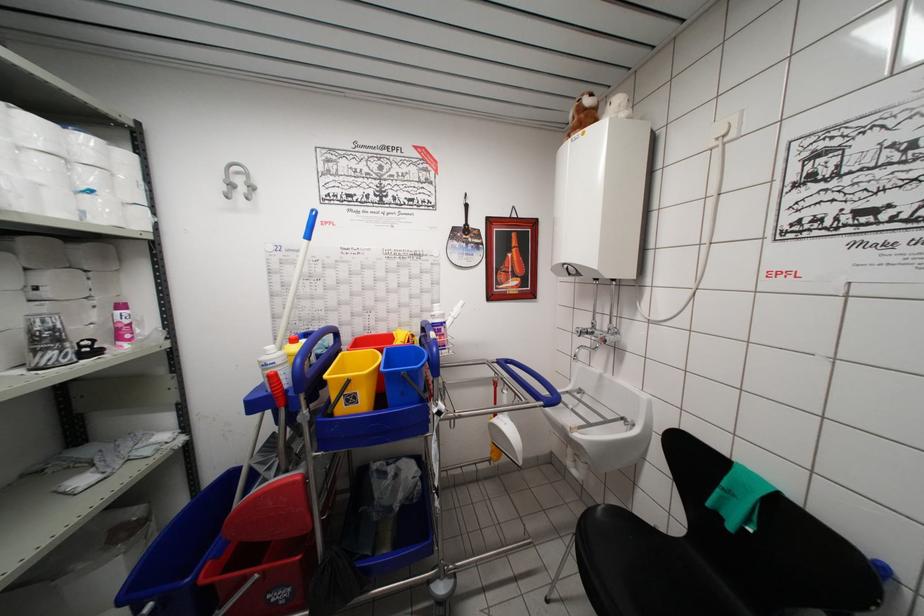
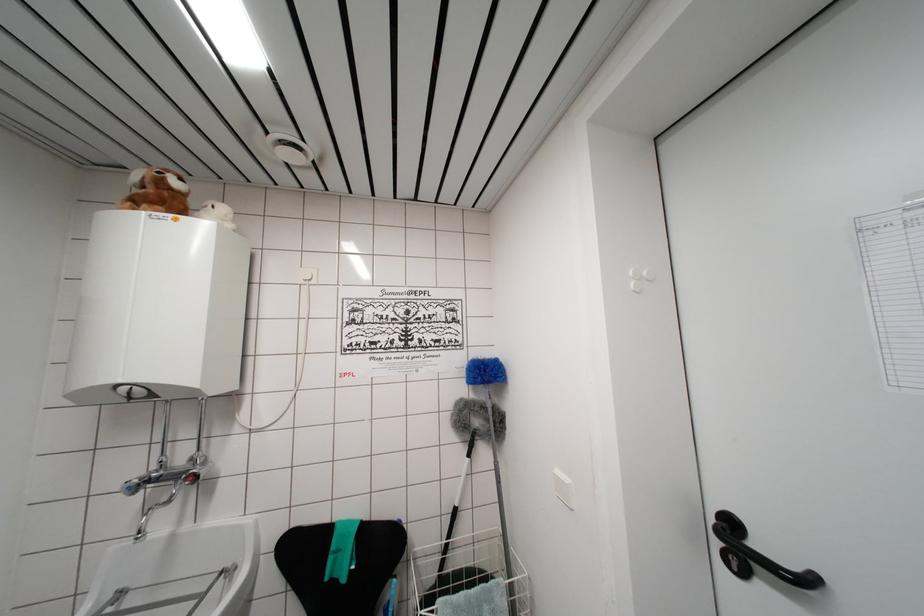
The point at [580,336] is marked in the first image. Where is the corresponding point in the second image?

(132, 493)